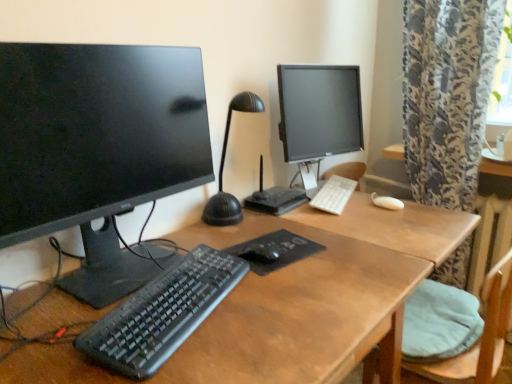
Identify the location of unoccupied region to the right of matte black monitor at left, marked as the second computer monitor in a right-to-left arrangement. The image size is (512, 384). (303, 282).